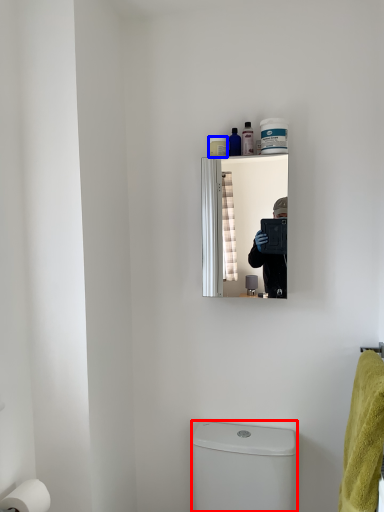
Question: Among these objects, which one is nearest to the camera, toilet bowl (highlighted by a red box) or toiletry (highlighted by a blue box)?

Choices:
 (A) toilet bowl
 (B) toiletry

Answer: (A)